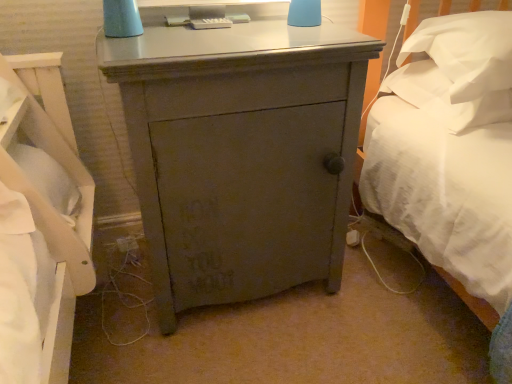
Image resolution: width=512 pixels, height=384 pixels. Find the location of `matte gray cabinet at center`. matte gray cabinet at center is located at coordinates click(x=241, y=154).

Describe the element at coordinates (241, 154) in the screenshot. This screenshot has width=512, height=384. I see `matte gray cabinet at center` at that location.

In the scene shown: Measure the distance between white soft pillow at upper right, the 2th pillow ordered from the bottom, and camera.

3.62 feet.

Find the location of `matte gray cabinet at center`. matte gray cabinet at center is located at coordinates (241, 154).

Does white soft pillow at right, marked as the 1th pillow in a bottom-to-top arrangement, come in front of matte gray cabinet at center?

No, the depth of white soft pillow at right, marked as the 1th pillow in a bottom-to-top arrangement, is greater than that of matte gray cabinet at center.

Between white soft pillow at right, marked as the 1th pillow in a bottom-to-top arrangement, and matte gray cabinet at center, which one has smaller size?

With smaller size is white soft pillow at right, marked as the 1th pillow in a bottom-to-top arrangement.

Looking at their sizes, would you say white soft pillow at right, marked as the 1th pillow in a bottom-to-top arrangement, is wider or thinner than matte gray cabinet at center?

white soft pillow at right, marked as the 1th pillow in a bottom-to-top arrangement, is thinner than matte gray cabinet at center.

Considering the points (426, 81) and (215, 280), which point is behind, point (426, 81) or point (215, 280)?

The point (426, 81) is farther from the camera.

From the image's perspective, relative to white soft pillow at upper right, the 2th pillow ordered from the bottom, is matte gray cabinet at center above or below?

Clearly, from the image's perspective, matte gray cabinet at center is below white soft pillow at upper right, the 2th pillow ordered from the bottom.

Considering the positions of points (333, 181) and (429, 27), is point (333, 181) farther from camera compared to point (429, 27)?

No, it is not.

From a real-world perspective, does matte gray cabinet at center stand above white soft pillow at upper right, which is counted as the 1th pillow, starting from the top?

No, from a real-world perspective, matte gray cabinet at center is not above white soft pillow at upper right, which is counted as the 1th pillow, starting from the top.

Considering the positions of objects matte gray cabinet at center and white soft pillow at upper right, the 2th pillow ordered from the bottom, in the image provided, who is more to the right, matte gray cabinet at center or white soft pillow at upper right, the 2th pillow ordered from the bottom,?

white soft pillow at upper right, the 2th pillow ordered from the bottom, is more to the right.

Could you measure the distance between white soft pillow at right, the second pillow positioned from the top, and white soft pillow at upper right, which is counted as the 1th pillow, starting from the top?

3.56 inches.

Considering the relative sizes of white soft pillow at right, marked as the 1th pillow in a bottom-to-top arrangement, and white soft pillow at upper right, which is counted as the 1th pillow, starting from the top, in the image provided, is white soft pillow at right, marked as the 1th pillow in a bottom-to-top arrangement, thinner than white soft pillow at upper right, which is counted as the 1th pillow, starting from the top,?

In fact, white soft pillow at right, marked as the 1th pillow in a bottom-to-top arrangement, might be wider than white soft pillow at upper right, which is counted as the 1th pillow, starting from the top.

Is white soft pillow at right, the second pillow positioned from the top, to the left of white soft pillow at upper right, the 2th pillow ordered from the bottom, from the viewer's perspective?

Indeed, white soft pillow at right, the second pillow positioned from the top, is positioned on the left side of white soft pillow at upper right, the 2th pillow ordered from the bottom.

Between white soft pillow at right, the second pillow positioned from the top, and white soft pillow at upper right, which is counted as the 1th pillow, starting from the top, which one has smaller size?

white soft pillow at right, the second pillow positioned from the top.

Locate an element on the screen. The width and height of the screenshot is (512, 384). nightstand in front of the white soft pillow at upper right, the 2th pillow ordered from the bottom is located at coordinates (241, 154).

Between white soft pillow at upper right, which is counted as the 1th pillow, starting from the top, and matte gray cabinet at center, which one appears on the left side from the viewer's perspective?

matte gray cabinet at center is more to the left.

Between white soft pillow at upper right, which is counted as the 1th pillow, starting from the top, and matte gray cabinet at center, which one has less height?

Standing shorter between the two is white soft pillow at upper right, which is counted as the 1th pillow, starting from the top.

Considering the sizes of white soft pillow at upper right, which is counted as the 1th pillow, starting from the top, and matte gray cabinet at center in the image, is white soft pillow at upper right, which is counted as the 1th pillow, starting from the top, wider or thinner than matte gray cabinet at center?

In the image, white soft pillow at upper right, which is counted as the 1th pillow, starting from the top, appears to be more narrow than matte gray cabinet at center.

Are white soft pillow at upper right, the 2th pillow ordered from the bottom, and white soft pillow at right, marked as the 1th pillow in a bottom-to-top arrangement, making contact?

Yes, white soft pillow at upper right, the 2th pillow ordered from the bottom, and white soft pillow at right, marked as the 1th pillow in a bottom-to-top arrangement, clearly make contact.

Is white soft pillow at upper right, which is counted as the 1th pillow, starting from the top, turned away from white soft pillow at right, marked as the 1th pillow in a bottom-to-top arrangement?

That's not correct — white soft pillow at upper right, which is counted as the 1th pillow, starting from the top, is not looking away from white soft pillow at right, marked as the 1th pillow in a bottom-to-top arrangement.

Between white soft pillow at upper right, which is counted as the 1th pillow, starting from the top, and white soft pillow at right, marked as the 1th pillow in a bottom-to-top arrangement, which one has smaller width?

white soft pillow at upper right, which is counted as the 1th pillow, starting from the top.

Between white soft pillow at upper right, which is counted as the 1th pillow, starting from the top, and white soft pillow at right, marked as the 1th pillow in a bottom-to-top arrangement, which one is positioned in front?

white soft pillow at upper right, which is counted as the 1th pillow, starting from the top.

Which of these two, matte gray cabinet at center or white soft pillow at right, the second pillow positioned from the top, is wider?

matte gray cabinet at center.

Looking at this image, relative to white soft pillow at right, marked as the 1th pillow in a bottom-to-top arrangement, is matte gray cabinet at center in front or behind?

matte gray cabinet at center is positioned closer to the viewer than white soft pillow at right, marked as the 1th pillow in a bottom-to-top arrangement.

Is white soft pillow at right, the second pillow positioned from the top, located within matte gray cabinet at center?

That's incorrect, white soft pillow at right, the second pillow positioned from the top, is not inside matte gray cabinet at center.

Looking at this image, measure the distance between matte gray cabinet at center and white soft pillow at right, marked as the 1th pillow in a bottom-to-top arrangement.

Result: The distance of matte gray cabinet at center from white soft pillow at right, marked as the 1th pillow in a bottom-to-top arrangement, is 22.61 inches.

From the image's perspective, which pillow is the 1st one above the matte gray cabinet at center? Please provide its 2D coordinates.

[(446, 97)]

I want to click on nightstand below the white soft pillow at upper right, which is counted as the 1th pillow, starting from the top (from the image's perspective), so click(241, 154).

Considering their positions, is white soft pillow at right, marked as the 1th pillow in a bottom-to-top arrangement, positioned further to white soft pillow at upper right, the 2th pillow ordered from the bottom, than matte gray cabinet at center?

Based on the image, matte gray cabinet at center appears to be further to white soft pillow at upper right, the 2th pillow ordered from the bottom.

Based on their spatial positions, is matte gray cabinet at center or white soft pillow at upper right, the 2th pillow ordered from the bottom, closer to white soft pillow at right, marked as the 1th pillow in a bottom-to-top arrangement?

white soft pillow at upper right, the 2th pillow ordered from the bottom, is closer to white soft pillow at right, marked as the 1th pillow in a bottom-to-top arrangement.

Which object lies further to the anchor point white soft pillow at right, marked as the 1th pillow in a bottom-to-top arrangement, white soft pillow at upper right, which is counted as the 1th pillow, starting from the top, or matte gray cabinet at center?

matte gray cabinet at center is positioned further to the anchor white soft pillow at right, marked as the 1th pillow in a bottom-to-top arrangement.

Looking at the image, which one is located closer to white soft pillow at upper right, the 2th pillow ordered from the bottom, matte gray cabinet at center or white soft pillow at right, the second pillow positioned from the top?

white soft pillow at right, the second pillow positioned from the top, is closer to white soft pillow at upper right, the 2th pillow ordered from the bottom.

Based on the photo, looking at the image, which one is located further to matte gray cabinet at center, white soft pillow at upper right, which is counted as the 1th pillow, starting from the top, or white soft pillow at right, the second pillow positioned from the top?

Based on the image, white soft pillow at right, the second pillow positioned from the top, appears to be further to matte gray cabinet at center.

When comparing their distances from matte gray cabinet at center, does white soft pillow at right, the second pillow positioned from the top, or white soft pillow at upper right, which is counted as the 1th pillow, starting from the top, seem further?

white soft pillow at right, the second pillow positioned from the top, is positioned further to the anchor matte gray cabinet at center.

Locate an element on the screen. This screenshot has height=384, width=512. pillow situated between matte gray cabinet at center and white soft pillow at upper right, which is counted as the 1th pillow, starting from the top, from left to right is located at coordinates (446, 97).